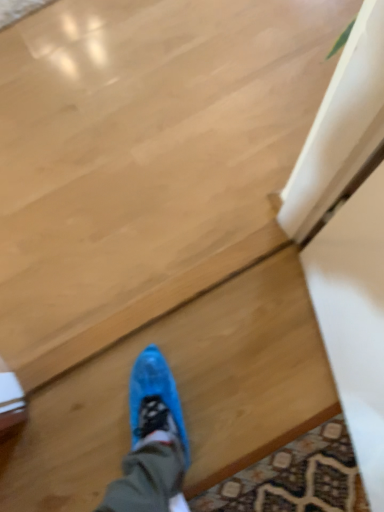
Question: Should I look upward or downward to see blue plastic shoe at center?

Choices:
 (A) down
 (B) up

Answer: (A)